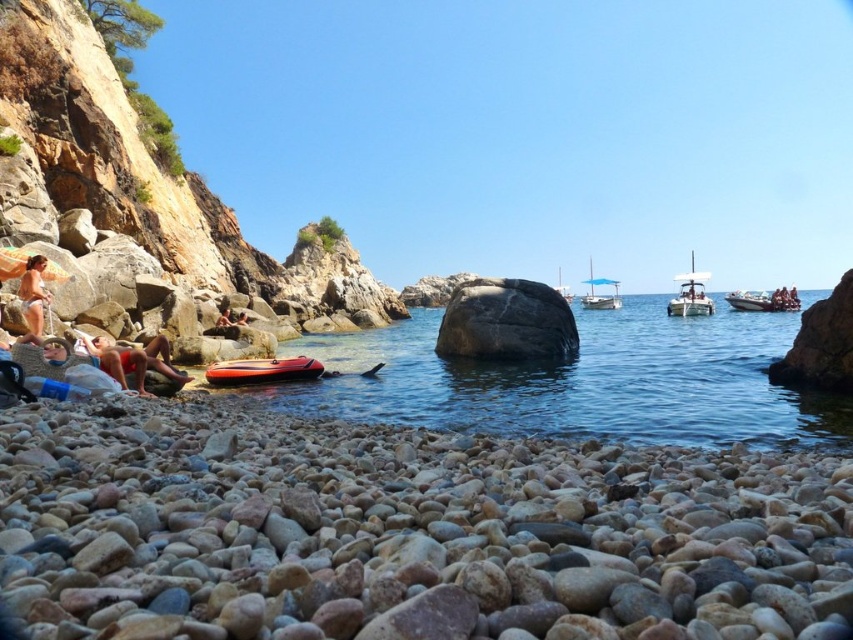
Can you confirm if red fabric shorts at lower left is wider than white glossy boat at right?

No.

Between point (131, 353) and point (706, 308), which one is positioned behind?

The point (706, 308) is behind.

Identify the location of red fabric shorts at lower left. (134, 360).

Image resolution: width=853 pixels, height=640 pixels. What do you see at coordinates (403, 532) in the screenshot?
I see `smooth pebbles at lower center` at bounding box center [403, 532].

Does smooth pebbles at lower center have a lesser height compared to white plastic boat at center?

Correct, smooth pebbles at lower center is not as tall as white plastic boat at center.

Which is behind, point (218, 547) or point (560, 285)?

Positioned behind is point (560, 285).

At what (x,y) coordinates should I click in order to perform the action: click on smooth pebbles at lower center. Please return your answer as a coordinate pair (x, y). This screenshot has height=640, width=853. Looking at the image, I should click on point(403,532).

Between point (36, 314) and point (677, 289), which one is positioned behind?

Positioned behind is point (677, 289).

Based on the photo, is the position of matte white bikini at left more distant than that of white glossy boat at right?

That is False.

I want to click on matte white bikini at left, so click(x=33, y=292).

Image resolution: width=853 pixels, height=640 pixels. Find the location of `matte white bikini at left`. matte white bikini at left is located at coordinates (33, 292).